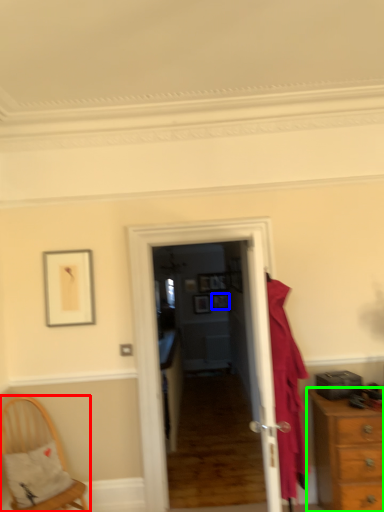
Question: Based on their relative distances, which object is farther from chair (highlighted by a red box)? Choose from picture frame (highlighted by a blue box) and chest of drawers (highlighted by a green box).

Choices:
 (A) picture frame
 (B) chest of drawers

Answer: (A)